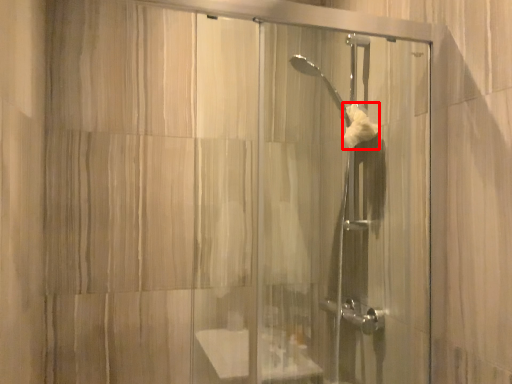
Question: From the image's perspective, where is hand towel (annotated by the red box) located relative to screen door?

Choices:
 (A) below
 (B) above

Answer: (B)